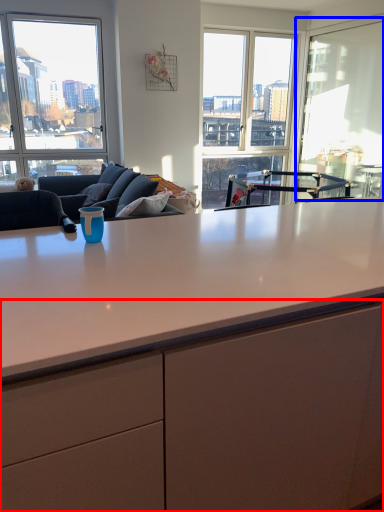
Question: Which of the following is the farthest to the observer, cabinetry (highlighted by a red box) or window screen (highlighted by a blue box)?

Choices:
 (A) cabinetry
 (B) window screen

Answer: (B)